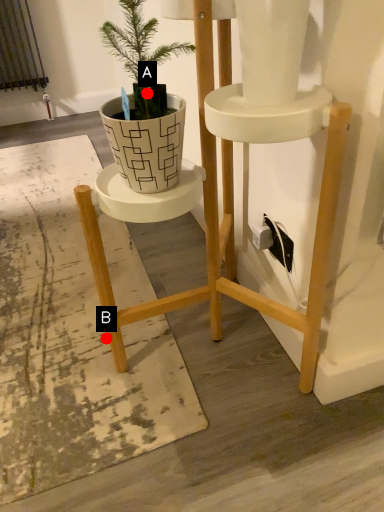
Question: Two points are circled on the image, labeled by A and B beside each circle. Among these points, which one is nearest to the camera?

Choices:
 (A) A is closer
 (B) B is closer

Answer: (A)